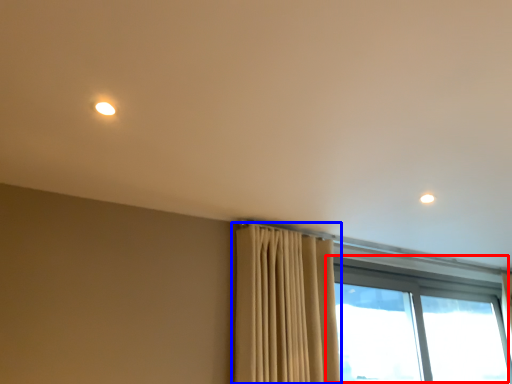
Question: Which object appears closest to the camera in this image, window (highlighted by a red box) or curtain (highlighted by a blue box)?

Choices:
 (A) window
 (B) curtain

Answer: (B)